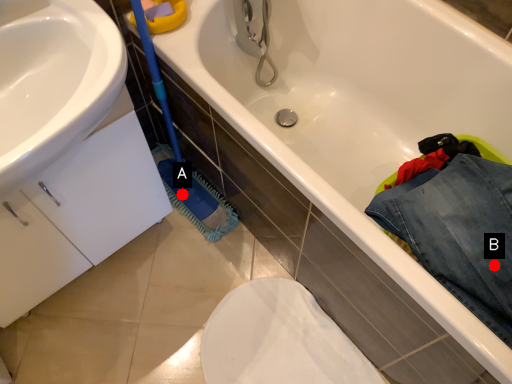
Question: Two points are circled on the image, labeled by A and B beside each circle. Among these points, which one is nearest to the camera?

Choices:
 (A) A is closer
 (B) B is closer

Answer: (B)